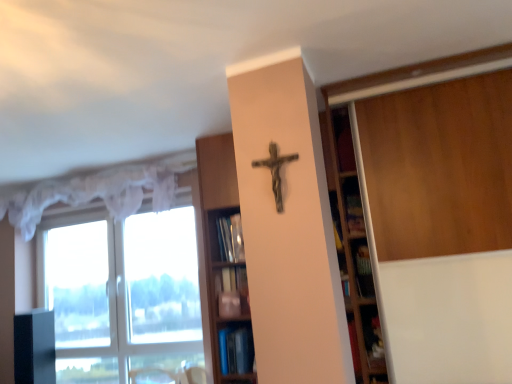
Question: Is rusty metal crucifix at center next to blue glossy bookshelf at lower center, placed as the second shelf when sorted from top to bottom?

Choices:
 (A) no
 (B) yes

Answer: (A)

Question: Is rusty metal crucifix at center not near blue glossy bookshelf at lower center, placed as the second shelf when sorted from top to bottom?

Choices:
 (A) yes
 (B) no

Answer: (A)

Question: From the image's perspective, is rusty metal crucifix at center beneath blue glossy bookshelf at lower center, placed as the second shelf when sorted from top to bottom?

Choices:
 (A) no
 (B) yes

Answer: (A)

Question: Considering the relative positions of rusty metal crucifix at center and blue glossy bookshelf at lower center, placed as the second shelf when sorted from top to bottom, in the image provided, is rusty metal crucifix at center in front of blue glossy bookshelf at lower center, placed as the second shelf when sorted from top to bottom,?

Choices:
 (A) no
 (B) yes

Answer: (B)

Question: Is blue glossy bookshelf at lower center, placed as the second shelf when sorted from top to bottom, completely or partially inside rusty metal crucifix at center?

Choices:
 (A) yes
 (B) no

Answer: (B)

Question: Is transparent glass window at left spatially inside wooden bookshelf at center, arranged as the first shelf when viewed from the top, or outside of it?

Choices:
 (A) outside
 (B) inside

Answer: (A)

Question: Does point (101, 258) appear closer or farther from the camera than point (199, 163)?

Choices:
 (A) closer
 (B) farther

Answer: (B)

Question: Considering the positions of transparent glass window at left and wooden bookshelf at center, arranged as the first shelf when viewed from the top, in the image, is transparent glass window at left taller or shorter than wooden bookshelf at center, arranged as the first shelf when viewed from the top,?

Choices:
 (A) short
 (B) tall

Answer: (A)

Question: Considering the relative positions of transparent glass window at left and wooden bookshelf at center, the second shelf from the bottom, in the image provided, is transparent glass window at left to the left or to the right of wooden bookshelf at center, the second shelf from the bottom,?

Choices:
 (A) right
 (B) left

Answer: (B)

Question: Relative to transparent glass window at left, is white sheer curtain at upper left in front or behind?

Choices:
 (A) front
 (B) behind

Answer: (A)

Question: From a real-world perspective, is white sheer curtain at upper left above or below transparent glass window at left?

Choices:
 (A) below
 (B) above

Answer: (B)

Question: From the image's perspective, is white sheer curtain at upper left above or below transparent glass window at left?

Choices:
 (A) below
 (B) above

Answer: (B)

Question: Looking at the image, does white sheer curtain at upper left seem bigger or smaller compared to transparent glass window at left?

Choices:
 (A) big
 (B) small

Answer: (B)

Question: In the image, is black glossy cabinet at left on the left side or the right side of white sheer curtain at upper left?

Choices:
 (A) left
 (B) right

Answer: (A)

Question: Is black glossy cabinet at left inside the boundaries of white sheer curtain at upper left, or outside?

Choices:
 (A) outside
 (B) inside

Answer: (A)